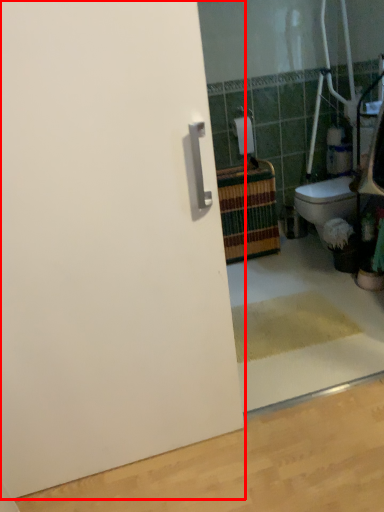
Question: From the image's perspective, considering the relative positions of door (annotated by the red box) and toilet paper in the image provided, where is door (annotated by the red box) located with respect to the staircase?

Choices:
 (A) above
 (B) below

Answer: (B)